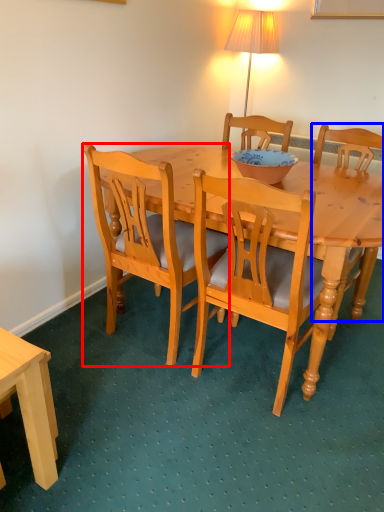
Question: Which object is closer to the camera taking this photo, chair (highlighted by a red box) or chair (highlighted by a blue box)?

Choices:
 (A) chair
 (B) chair

Answer: (A)